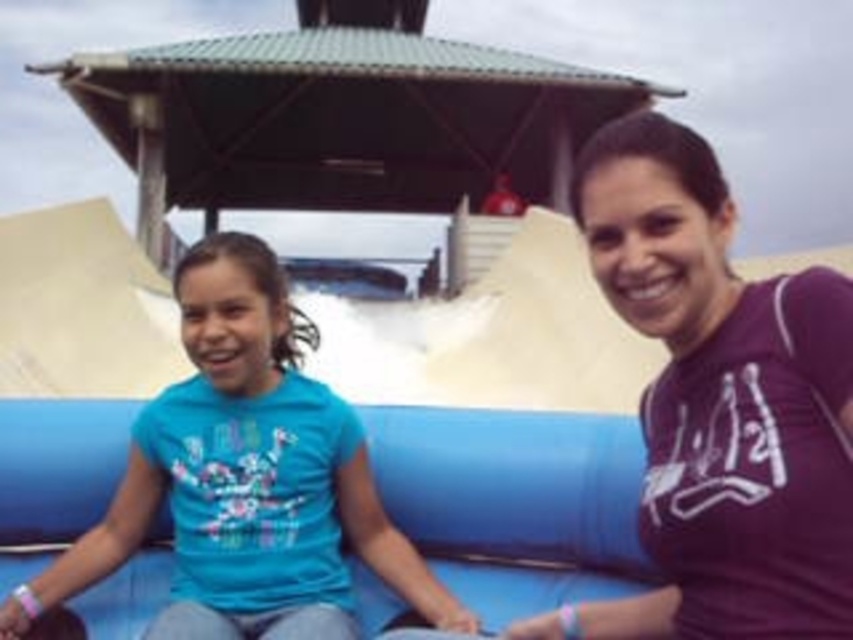
Question: Which object is closer to the camera taking this photo?

Choices:
 (A) blue fabric shirt at center
 (B) purple matte shirt at center

Answer: (B)

Question: Which object appears farthest from the camera in this image?

Choices:
 (A) blue fabric shirt at center
 (B) purple matte shirt at center

Answer: (A)

Question: Does purple matte shirt at center come behind blue fabric shirt at center?

Choices:
 (A) no
 (B) yes

Answer: (A)

Question: Is purple matte shirt at center wider than blue fabric shirt at center?

Choices:
 (A) yes
 (B) no

Answer: (B)

Question: Is purple matte shirt at center positioned behind blue fabric shirt at center?

Choices:
 (A) yes
 (B) no

Answer: (B)